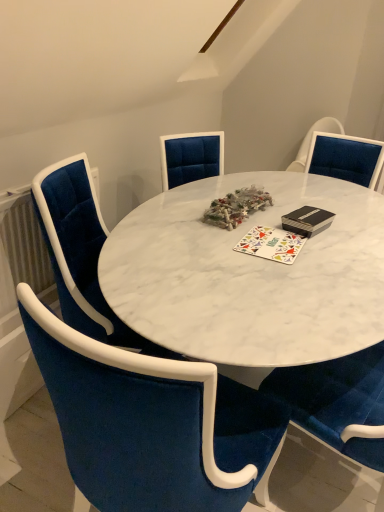
The width and height of the screenshot is (384, 512). I want to click on vacant space situated on the left part of multicolored fabric mat at center, so click(x=206, y=244).